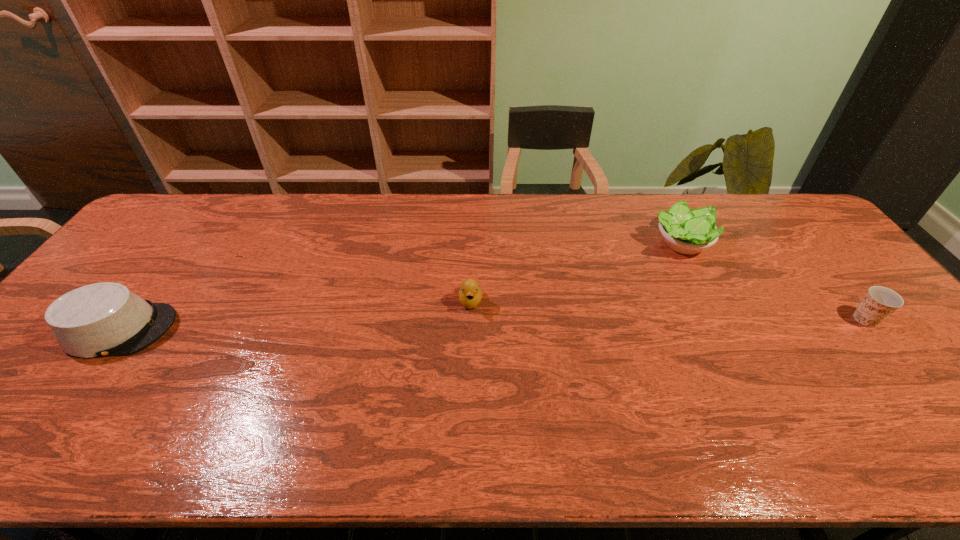
This screenshot has width=960, height=540. Find the location of `free spot between the lettuce and the hat`. free spot between the lettuce and the hat is located at coordinates (400, 286).

This screenshot has width=960, height=540. Identify the location of blank region between the hat and the duckling. (296, 315).

Locate an element on the screen. blank region between the third object from left to right and the hat is located at coordinates (400, 286).

Where is `vacant area that lies between the hat and the rightmost object`? This screenshot has height=540, width=960. vacant area that lies between the hat and the rightmost object is located at coordinates (493, 324).

Select which object appears as the closest to the duckling. Please provide its 2D coordinates. Your answer should be formatted as a tuple, i.e. [(x, y)], where the tuple contains the x and y coordinates of a point satisfying the conditions above.

[(688, 232)]

Point out which object is positioned as the third nearest to the second object from right to left. Please provide its 2D coordinates. Your answer should be formatted as a tuple, i.e. [(x, y)], where the tuple contains the x and y coordinates of a point satisfying the conditions above.

[(105, 319)]

This screenshot has width=960, height=540. I want to click on vacant region that satisfies the following two spatial constraints: 1. facing forward on the Dixie cup; 2. on the left side of the second object from left to right, so click(470, 320).

In order to click on free space in the image that satisfies the following two spatial constraints: 1. facing forward on the Dixie cup; 2. on the right side of the third object from right to left in this screenshot , I will do `click(470, 320)`.